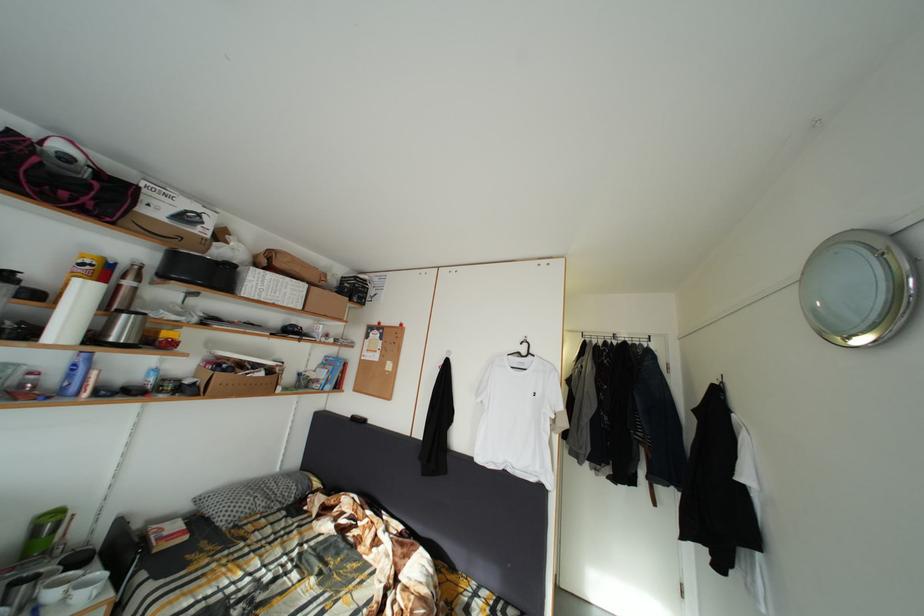
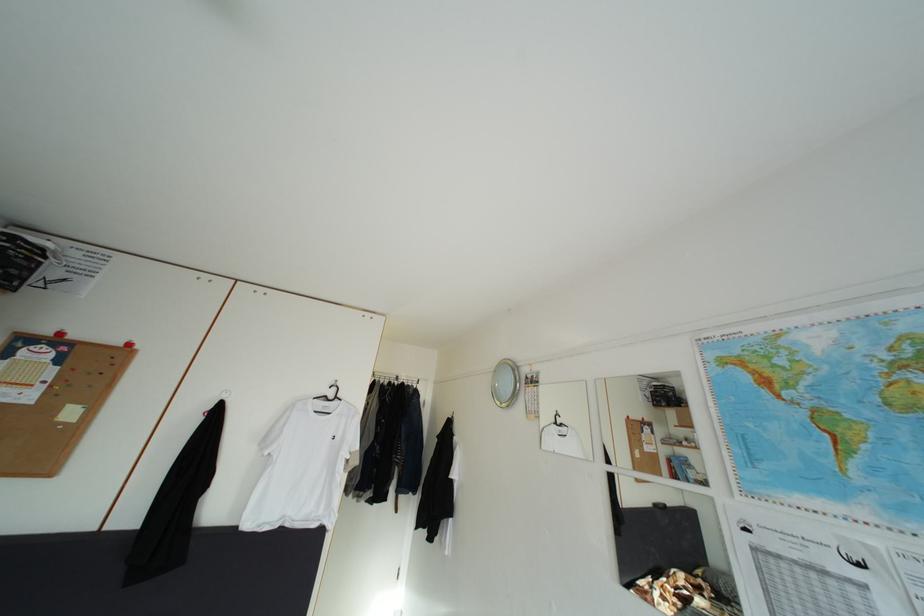
In the second image, find the point that corresponds to (x=531, y=357) in the first image.

(339, 400)